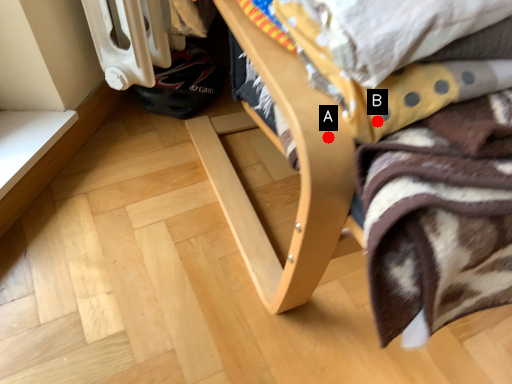
Question: Two points are circled on the image, labeled by A and B beside each circle. Which of the following is the farthest from the observer?

Choices:
 (A) A is further
 (B) B is further

Answer: (B)